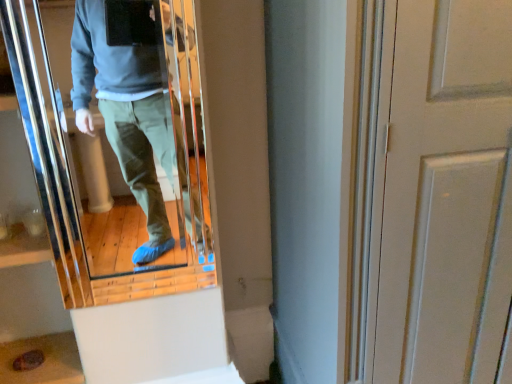
Find the location of a particular element. The height and width of the screenshot is (384, 512). white matte door at center right is located at coordinates (447, 195).

Image resolution: width=512 pixels, height=384 pixels. What do you see at coordinates (447, 195) in the screenshot?
I see `white matte door at center right` at bounding box center [447, 195].

This screenshot has height=384, width=512. In order to click on matte glass mirror at center in this screenshot , I will do `click(130, 99)`.

Describe the element at coordinates (130, 99) in the screenshot. This screenshot has height=384, width=512. I see `matte glass mirror at center` at that location.

Where is `white matte door at center right`? Image resolution: width=512 pixels, height=384 pixels. white matte door at center right is located at coordinates (447, 195).

Considering the relative positions of white matte door at center right and matte glass mirror at center in the image provided, is white matte door at center right to the left of matte glass mirror at center from the viewer's perspective?

No.

Considering the positions of objects white matte door at center right and matte glass mirror at center in the image provided, who is in front, white matte door at center right or matte glass mirror at center?

white matte door at center right is closer to the camera.

Which is nearer, [406,86] or [162,95]?

Clearly, point [406,86] is closer to the camera than point [162,95].

From the image's perspective, is white matte door at center right located beneath matte glass mirror at center?

Yes, from the image's perspective, white matte door at center right is beneath matte glass mirror at center.

From a real-world perspective, is white matte door at center right positioned under matte glass mirror at center based on gravity?

Yes, from a real-world perspective, white matte door at center right is below matte glass mirror at center.

Is white matte door at center right wider than matte glass mirror at center?

Indeed, white matte door at center right has a greater width compared to matte glass mirror at center.

Does white matte door at center right have a lesser height compared to matte glass mirror at center?

In fact, white matte door at center right may be taller than matte glass mirror at center.

Considering the relative sizes of white matte door at center right and matte glass mirror at center in the image provided, is white matte door at center right smaller than matte glass mirror at center?

Incorrect, white matte door at center right is not smaller in size than matte glass mirror at center.

Is white matte door at center right completely or partially outside of matte glass mirror at center?

Yes, white matte door at center right is located beyond the bounds of matte glass mirror at center.

Would you consider white matte door at center right to be distant from matte glass mirror at center?

No, white matte door at center right is not far away from matte glass mirror at center.

Could you tell me if white matte door at center right is facing matte glass mirror at center?

No, white matte door at center right is not aimed at matte glass mirror at center.

Measure the distance between white matte door at center right and matte glass mirror at center.

27.11 inches.

The width and height of the screenshot is (512, 384). Find the location of `door below the matte glass mirror at center (from a real-world perspective)`. door below the matte glass mirror at center (from a real-world perspective) is located at coordinates pyautogui.click(x=447, y=195).

Considering the positions of objects matte glass mirror at center and white matte door at center right in the image provided, who is more to the right, matte glass mirror at center or white matte door at center right?

Positioned to the right is white matte door at center right.

In the image, is matte glass mirror at center positioned in front of or behind white matte door at center right?

matte glass mirror at center is positioned farther from the viewer than white matte door at center right.

Considering the positions of points (144, 171) and (461, 225), is point (144, 171) farther from camera compared to point (461, 225)?

That is True.

From the image's perspective, between matte glass mirror at center and white matte door at center right, which one is located above?

matte glass mirror at center.

In the scene shown: From a real-world perspective, who is located higher, matte glass mirror at center or white matte door at center right?

From a 3D spatial view, matte glass mirror at center is above.

Which object is thinner, matte glass mirror at center or white matte door at center right?

matte glass mirror at center.

Does matte glass mirror at center have a lesser height compared to white matte door at center right?

Yes.

Is matte glass mirror at center bigger or smaller than white matte door at center right?

Clearly, matte glass mirror at center is smaller in size than white matte door at center right.

Is matte glass mirror at center outside of white matte door at center right?

Yes, matte glass mirror at center is not within white matte door at center right.

Is matte glass mirror at center far away from white matte door at center right?

Actually, matte glass mirror at center and white matte door at center right are a little close together.

Could you tell me if matte glass mirror at center is turned towards white matte door at center right?

No, matte glass mirror at center is not facing towards white matte door at center right.

Measure the distance between matte glass mirror at center and white matte door at center right.

The distance of matte glass mirror at center from white matte door at center right is 68.87 centimeters.

In the image, there is a matte glass mirror at center. At what (x,y) coordinates should I click in order to perform the action: click on door below it (from the image's perspective). Please return your answer as a coordinate pair (x, y). This screenshot has width=512, height=384. Looking at the image, I should click on (447, 195).

The width and height of the screenshot is (512, 384). I want to click on mirror above the white matte door at center right (from the image's perspective), so 130,99.

Find the location of a particular element. The width and height of the screenshot is (512, 384). door located below the matte glass mirror at center (from the image's perspective) is located at coordinates (447, 195).